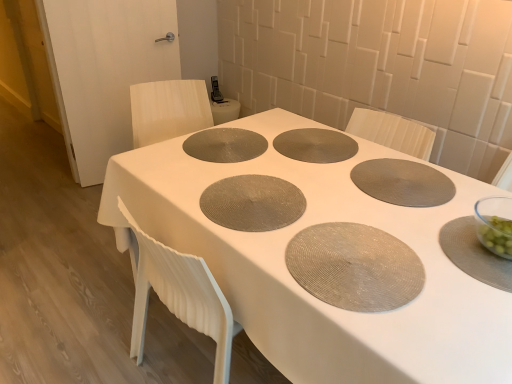
Image resolution: width=512 pixels, height=384 pixels. I want to click on free point to the right of matte gray placemat at center, the second oval in the top-to-bottom sequence, so click(439, 248).